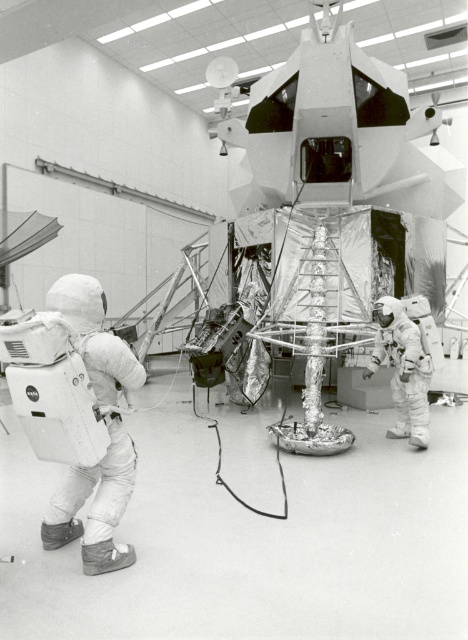
Question: Is white fabric spacesuit at left smaller than white textured spacesuit at center-right?

Choices:
 (A) yes
 (B) no

Answer: (A)

Question: Is white fabric spacesuit at left positioned behind white textured spacesuit at center-right?

Choices:
 (A) no
 (B) yes

Answer: (A)

Question: Can you confirm if white fabric spacesuit at left is positioned above white textured spacesuit at center-right?

Choices:
 (A) yes
 (B) no

Answer: (B)

Question: Which object appears farthest from the camera in this image?

Choices:
 (A) white textured spacesuit at center-right
 (B) white fabric spacesuit at left

Answer: (A)

Question: Among these points, which one is nearest to the camera?

Choices:
 (A) (416, 364)
 (B) (58, 540)

Answer: (B)

Question: Among these objects, which one is nearest to the camera?

Choices:
 (A) white fabric spacesuit at left
 (B) white textured spacesuit at center-right

Answer: (A)